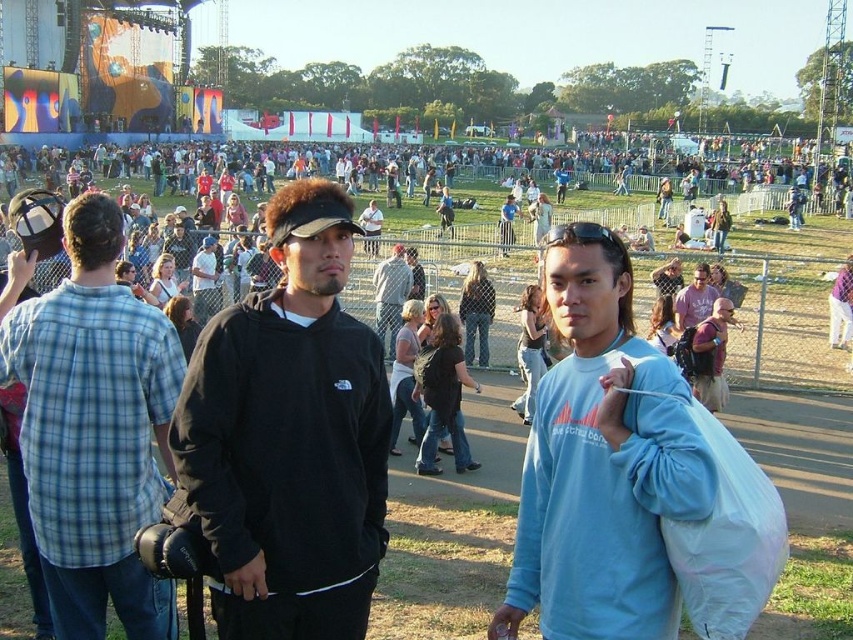
Question: Where is black matte sweatshirt at center located in relation to light blue sweatshirt at center in the image?

Choices:
 (A) left
 (B) right

Answer: (A)

Question: Does light blue sweatshirt at center have a greater width compared to blue plaid shirt at left?

Choices:
 (A) yes
 (B) no

Answer: (B)

Question: Estimate the real-world distances between objects in this image. Which object is farther from the white shirt at center?

Choices:
 (A) blue plaid shirt at left
 (B) light blue sweatshirt at center
 (C) black matte sweatshirt at center

Answer: (B)

Question: Where is black matte sweatshirt at center located in relation to blue plaid shirt at left in the image?

Choices:
 (A) above
 (B) below

Answer: (B)

Question: Which of the following is the farthest from the observer?

Choices:
 (A) (131, 502)
 (B) (375, 289)
 (C) (212, 250)
 (D) (242, 481)

Answer: (C)

Question: Which point appears farthest from the camera in this image?

Choices:
 (A) click(x=62, y=289)
 (B) click(x=300, y=524)

Answer: (A)